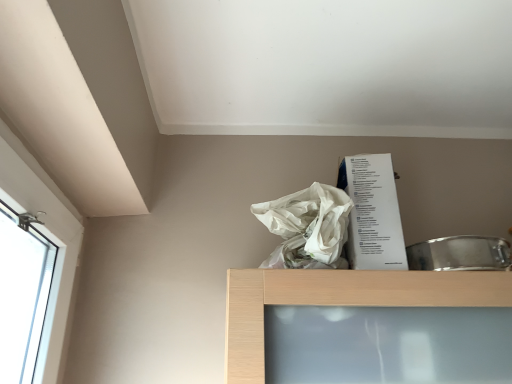
Question: Is point (336, 192) positioned closer to the camera than point (350, 182)?

Choices:
 (A) farther
 (B) closer

Answer: (B)

Question: From the image's perspective, is white plastic bag at upper center above or below white paper at upper center?

Choices:
 (A) below
 (B) above

Answer: (B)

Question: From a real-world perspective, is white plastic bag at upper center physically located above or below white paper at upper center?

Choices:
 (A) below
 (B) above

Answer: (A)

Question: Which is correct: white paper at upper center is inside white plastic bag at upper center, or outside of it?

Choices:
 (A) outside
 (B) inside

Answer: (A)

Question: Considering the positions of point (382, 163) and point (312, 248), is point (382, 163) closer or farther from the camera than point (312, 248)?

Choices:
 (A) farther
 (B) closer

Answer: (A)

Question: Is white paper at upper center taller or shorter than white plastic bag at upper center?

Choices:
 (A) short
 (B) tall

Answer: (B)

Question: In terms of size, does white paper at upper center appear bigger or smaller than white plastic bag at upper center?

Choices:
 (A) small
 (B) big

Answer: (B)